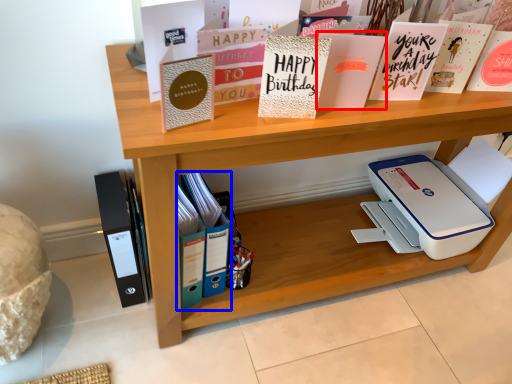
Question: Among these objects, which one is farthest to the camera, paperback book (highlighted by a red box) or book (highlighted by a blue box)?

Choices:
 (A) paperback book
 (B) book

Answer: (B)